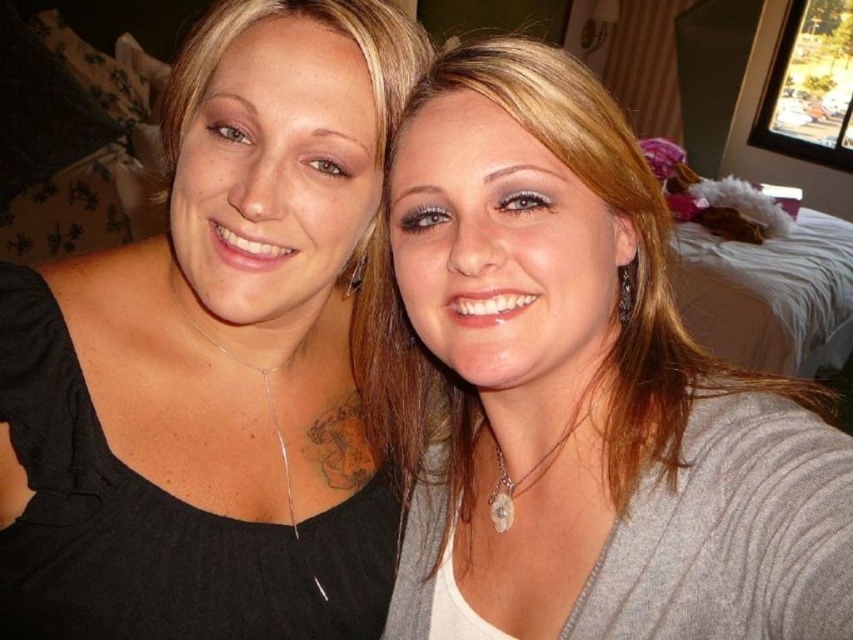
Question: Does black matte shirt at left come in front of matte gray sweater at center?

Choices:
 (A) no
 (B) yes

Answer: (A)

Question: Is black matte shirt at left bigger than matte gray sweater at center?

Choices:
 (A) no
 (B) yes

Answer: (B)

Question: In this image, where is black matte shirt at left located relative to matte gray sweater at center?

Choices:
 (A) right
 (B) left

Answer: (B)

Question: Among these points, which one is farthest from the camera?

Choices:
 (A) (508, 461)
 (B) (146, 531)

Answer: (A)

Question: Which point is farther to the camera?

Choices:
 (A) (187, 70)
 (B) (628, 339)

Answer: (B)